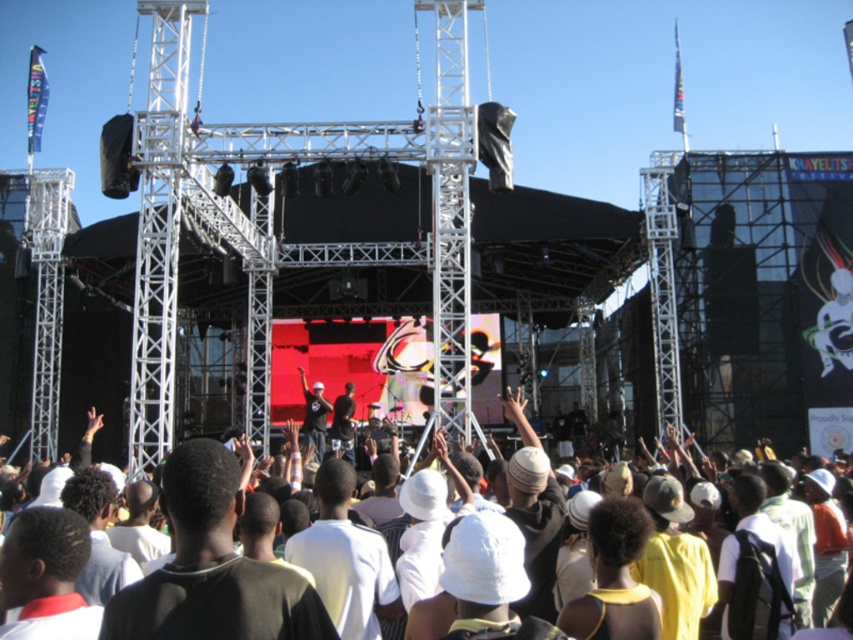
You are a performer on the stage and want to acknowledge the crowd. Which group should you look towards first to see the white cotton crowd at center and the matte black shirt at center?

You should look towards the white cotton crowd at center first since they are positioned in front of the matte black shirt at center, making them more visible from the stage.

Consider the image. You are a performer on the stage and want to interact with the audience. You see the white cotton crowd at center and the matte black shirt at center. Which group is closer to the stage?

The white cotton crowd at center is closer to the stage than the matte black shirt at center because the distance between them is 26.88 meters, implying the white cotton crowd is nearer to the stage.

You are a photographer at the concert and want to capture the crowd. Where exactly is the white cotton crowd at center located in the image?

The white cotton crowd at center is located at point (811, 524) in the image.